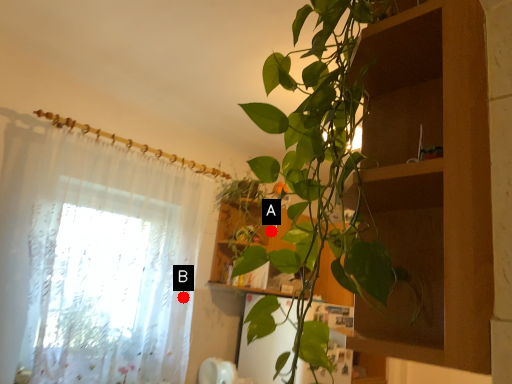
Question: Two points are circled on the image, labeled by A and B beside each circle. Which point is further to the camera?

Choices:
 (A) A is further
 (B) B is further

Answer: (A)